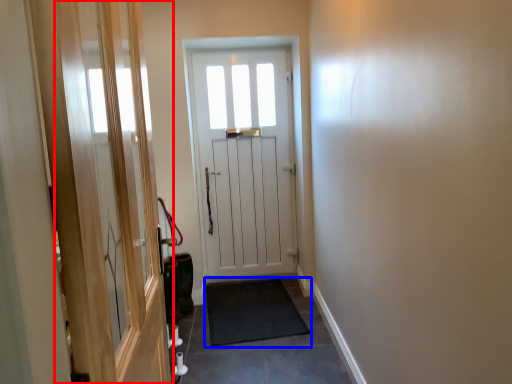
Question: Which point is closer to the camera, screen door (highlighted by a red box) or doormat (highlighted by a blue box)?

Choices:
 (A) screen door
 (B) doormat

Answer: (A)